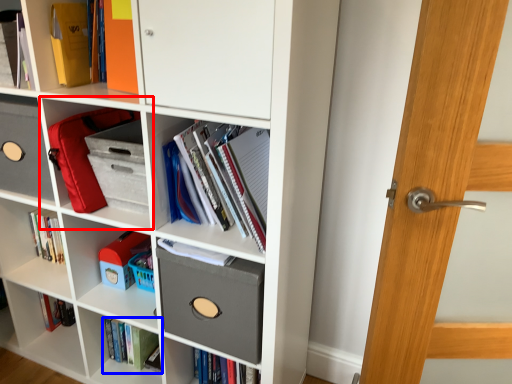
Question: Which object is further to the camera taking this photo, shelf (highlighted by a red box) or book (highlighted by a blue box)?

Choices:
 (A) shelf
 (B) book

Answer: (B)